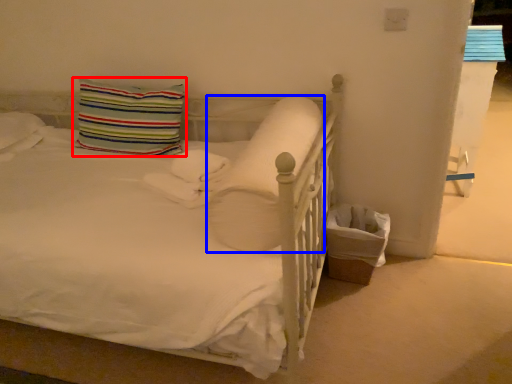
Question: Which point is closer to the camera, pillow (highlighted by a red box) or pillow (highlighted by a blue box)?

Choices:
 (A) pillow
 (B) pillow

Answer: (B)